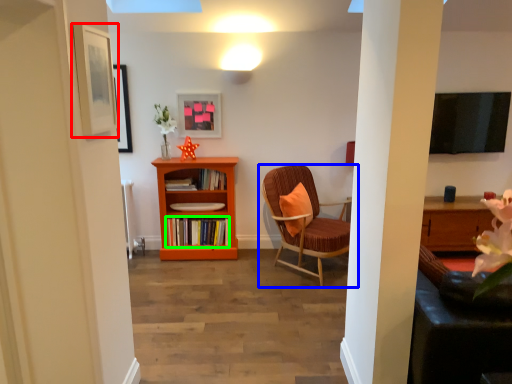
Question: Estimate the real-world distances between objects in this image. Which object is farther from picture frame (highlighted by a red box), chair (highlighted by a blue box) or book (highlighted by a green box)?

Choices:
 (A) chair
 (B) book

Answer: (B)